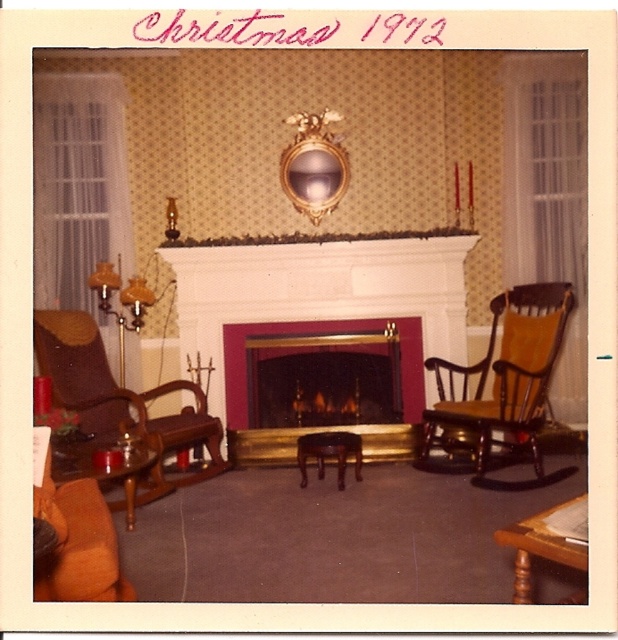
You are sitting in the living room and want to reach the wooden coffee table at lower left from the matte brown leather rocking chair at lower left. Which direction should you move to get there?

Since the matte brown leather rocking chair at lower left is closer to the viewer than the wooden coffee table at lower left, you should move backward to reach the wooden coffee table at lower left.

You are a delivery person who needs to place a package between the gold metallic fireplace at center and the wooden rocking chair at right. The package is 25 inches long. Will it fit in the space between them?

The space between the gold metallic fireplace at center and the wooden rocking chair at right is 26.11 inches. Since the package is 25 inches long, it will fit with a little extra space remaining.

In the scene shown: You are sitting in the living room and want to move from the wooden coffee table at lower left to the matte brown leather rocking chair at lower left. Which direction should you move to reach the chair?

You should move to the right to reach the matte brown leather leather rocking chair at lower left because it is positioned to the right of the wooden coffee table at lower left.